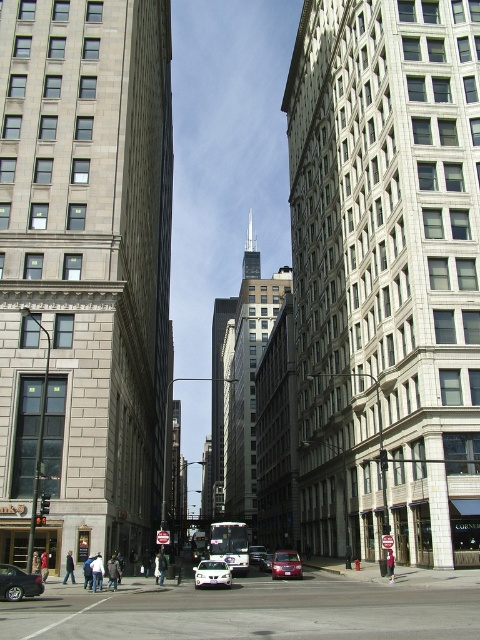
Who is lower down, glass skyscraper at center or white glossy sedan at center?

glass skyscraper at center is lower down.

Which is behind, point (223, 444) or point (230, 573)?

Positioned behind is point (223, 444).

Where is `glass skyscraper at center`? This screenshot has width=480, height=640. glass skyscraper at center is located at coordinates (217, 400).

At what (x,y) coordinates should I click in order to perform the action: click on glass skyscraper at center. Please return your answer as a coordinate pair (x, y). Looking at the image, I should click on 217,400.

Locate an element on the screen. The height and width of the screenshot is (640, 480). glass skyscraper at center is located at coordinates (217, 400).

This screenshot has width=480, height=640. Identify the location of glass skyscraper at center. 217,400.

Does point (14, 576) come in front of point (201, 573)?

Yes.

Is shiny silver sedan at lower left closer to camera compared to white glossy sedan at center?

Yes, shiny silver sedan at lower left is in front of white glossy sedan at center.

Which is in front, point (29, 588) or point (226, 568)?

Point (29, 588) is in front.

Find the location of a particular element. shiny silver sedan at lower left is located at coordinates (17, 582).